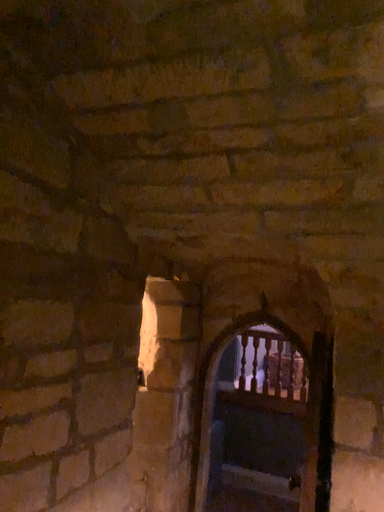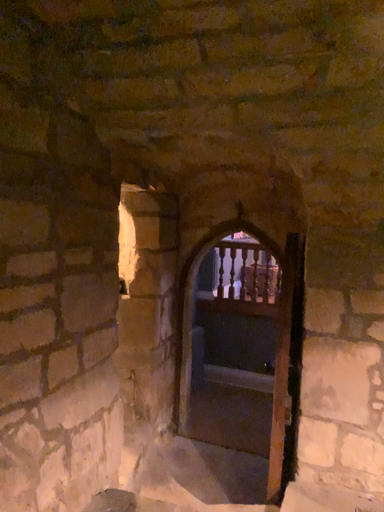
Question: How did the camera likely rotate when shooting the video?

Choices:
 (A) rotated upward
 (B) rotated downward

Answer: (B)